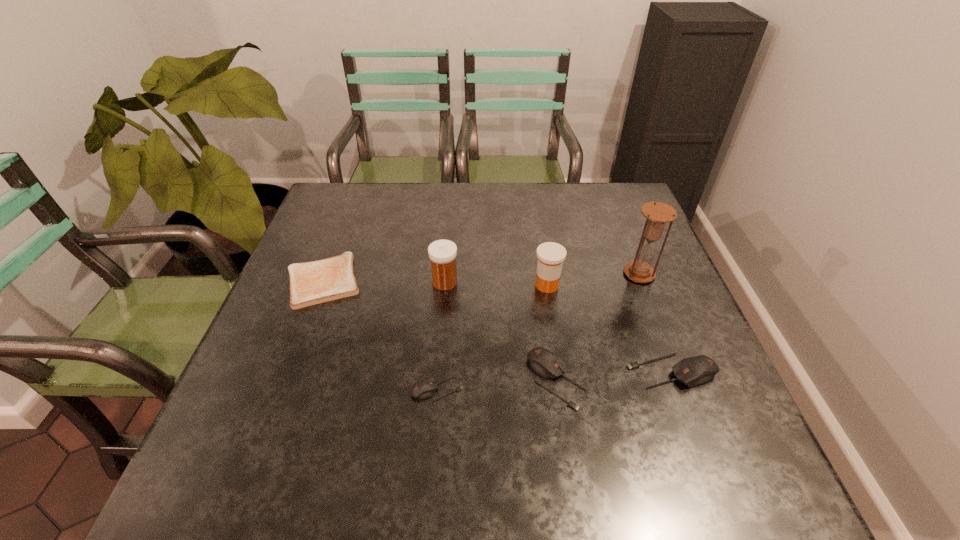
Where is `mouse positioned at the right edge`? The width and height of the screenshot is (960, 540). mouse positioned at the right edge is located at coordinates (692, 371).

Where is `hourglass at the right edge`? This screenshot has height=540, width=960. hourglass at the right edge is located at coordinates (658, 214).

In order to click on vacant space at the far edge of the desktop in this screenshot , I will do `click(406, 222)`.

Locate an element on the screen. The width and height of the screenshot is (960, 540). free region at the left edge of the desktop is located at coordinates 264,390.

Image resolution: width=960 pixels, height=540 pixels. In the image, there is a desktop. Find the location of `blank space at the right edge`. blank space at the right edge is located at coordinates (645, 360).

Identify the location of vacant space at the far left corner. This screenshot has height=540, width=960. (349, 183).

The width and height of the screenshot is (960, 540). In the image, there is a desktop. Identify the location of vacant space at the near left corner. (240, 413).

Identify the location of free region at the far right corner of the desktop. (621, 195).

I want to click on free space between the tallest object and the leftmost object, so click(x=481, y=277).

Locate an element on the screen. This screenshot has width=960, height=540. free space between the second tallest mouse and the second shortest object is located at coordinates (496, 385).